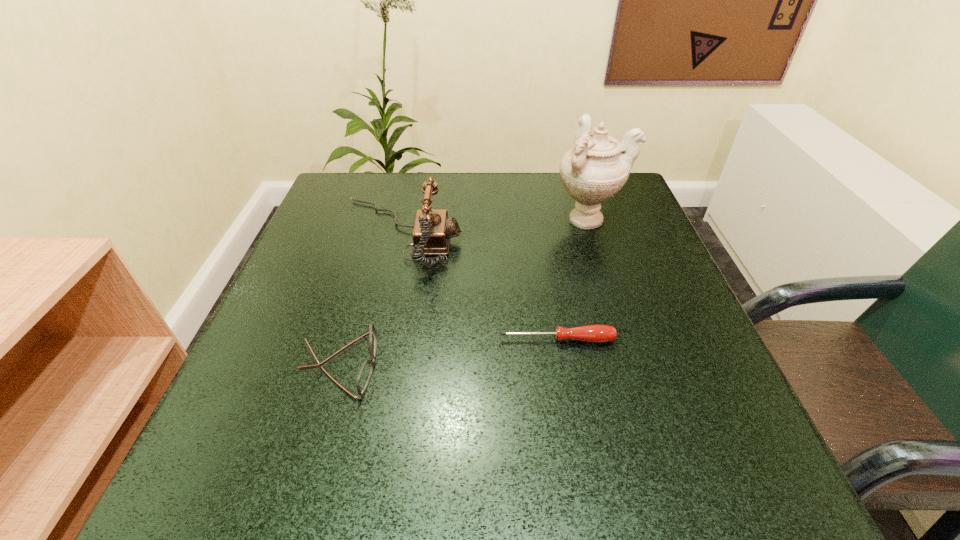
Find the location of a particular element. Image resolution: width=960 pixels, height=540 pixels. free space between the second tallest object and the urn is located at coordinates (493, 227).

Select which object appears as the closest to the tallest object. Please provide its 2D coordinates. Your answer should be formatted as a tuple, i.e. [(x, y)], where the tuple contains the x and y coordinates of a point satisfying the conditions above.

[(432, 231)]

Locate an element on the screen. This screenshot has width=960, height=540. the third closest object relative to the spectacles is located at coordinates (597, 166).

Locate an element on the screen. This screenshot has width=960, height=540. free spot that satisfies the following two spatial constraints: 1. on the back side of the urn; 2. on the left side of the shortest object is located at coordinates (537, 219).

Where is `blank area in the image that satisfies the following two spatial constraints: 1. on the back side of the urn; 2. on the left side of the screwdriver`? blank area in the image that satisfies the following two spatial constraints: 1. on the back side of the urn; 2. on the left side of the screwdriver is located at coordinates (537, 219).